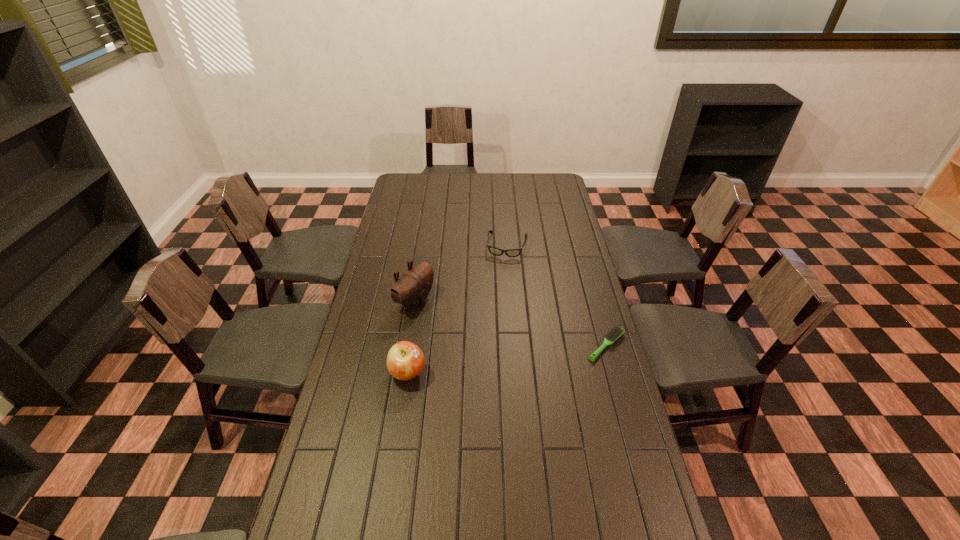
You are a GUI agent. You are given a task and a screenshot of the screen. Output one action in this format:
    pyautogui.click(x=<x>, y=<y>)
    Task: Click on the vacant space on the desktop that is between the apple and the rightmost object and is positioned on the front-facing side of the spectacles
    This screenshot has width=960, height=540.
    Given the screenshot: What is the action you would take?
    pyautogui.click(x=484, y=362)

Where is `vacant space on the desktop that is between the apple and the rightmost object and is positioned with the flap open on the third nearest object`? The image size is (960, 540). vacant space on the desktop that is between the apple and the rightmost object and is positioned with the flap open on the third nearest object is located at coordinates (524, 356).